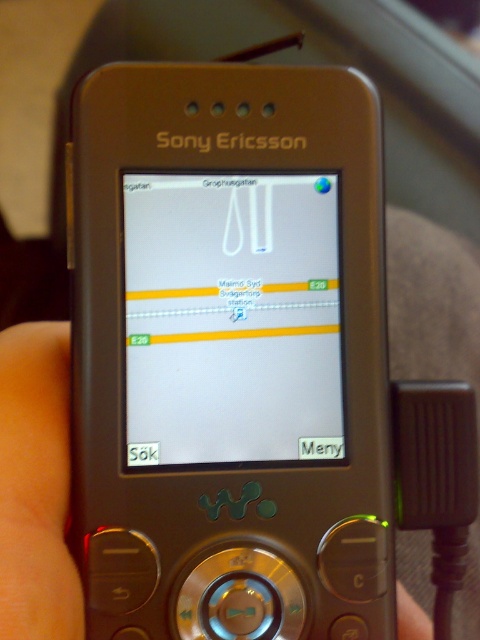
Question: Which object appears closest to the camera in this image?

Choices:
 (A) metallic silver phone at center
 (B) matte silver screen at center

Answer: (A)

Question: Which point is closer to the camera taking this photo?

Choices:
 (A) (304, 388)
 (B) (64, 326)

Answer: (A)

Question: Does matte silver screen at center come behind metallic silver phone at center?

Choices:
 (A) no
 (B) yes

Answer: (B)

Question: Is the position of matte silver screen at center less distant than that of metallic silver phone at center?

Choices:
 (A) yes
 (B) no

Answer: (B)

Question: Does matte silver screen at center have a larger size compared to metallic silver phone at center?

Choices:
 (A) yes
 (B) no

Answer: (B)